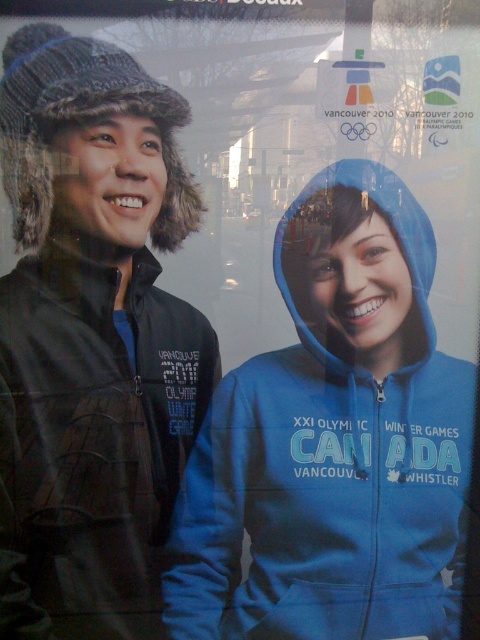
Can you confirm if matte black jacket at left is positioned to the right of blue zip-up hoodie at center?

Incorrect, matte black jacket at left is not on the right side of blue zip-up hoodie at center.

The image size is (480, 640). I want to click on matte black jacket at left, so click(92, 337).